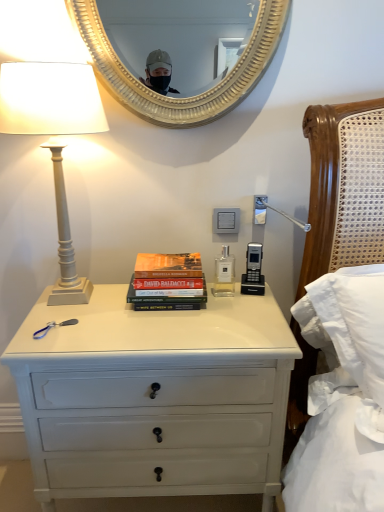
Where is `free space on the front side of hardcover books at center`? This screenshot has width=384, height=512. free space on the front side of hardcover books at center is located at coordinates (173, 329).